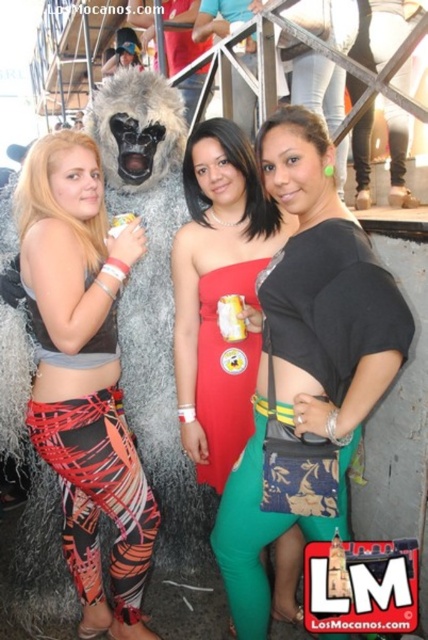
Between black matte top at center and matte red dress at center, which one has less height?

matte red dress at center is shorter.

Is point (344, 499) closer to viewer compared to point (192, 339)?

That is True.

Describe the element at coordinates (306, 365) in the screenshot. Image resolution: width=428 pixels, height=640 pixels. I see `black matte top at center` at that location.

Locate an element on the screen. This screenshot has width=428, height=640. black matte top at center is located at coordinates click(306, 365).

Can you confirm if printed leggings at left is bigger than red satin dress at center?

Yes, printed leggings at left is bigger than red satin dress at center.

Between printed leggings at left and red satin dress at center, which one is positioned lower?

Positioned lower is printed leggings at left.

Image resolution: width=428 pixels, height=640 pixels. Identify the location of printed leggings at left. (83, 374).

Image resolution: width=428 pixels, height=640 pixels. I want to click on printed leggings at left, so point(83,374).

The height and width of the screenshot is (640, 428). What do you see at coordinates (306, 365) in the screenshot? I see `black matte top at center` at bounding box center [306, 365].

Can you confirm if black matte top at center is positioned below printed leggings at left?

No.

The width and height of the screenshot is (428, 640). I want to click on black matte top at center, so click(x=306, y=365).